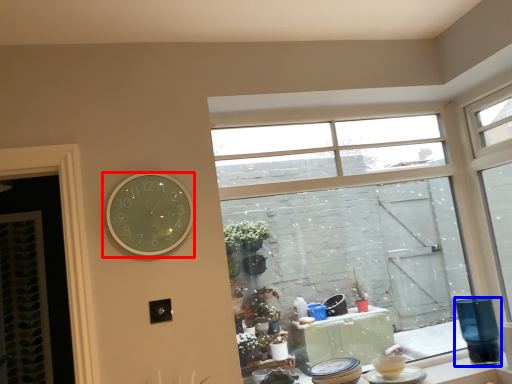
Question: Which object appears closest to the camera in this image, wall clock (highlighted by a red box) or glass vase (highlighted by a blue box)?

Choices:
 (A) wall clock
 (B) glass vase

Answer: (A)